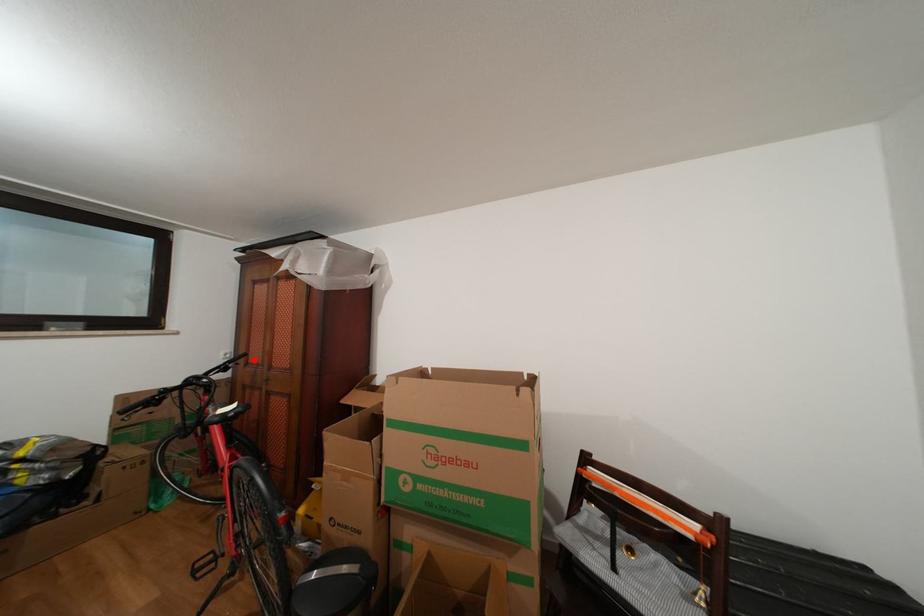
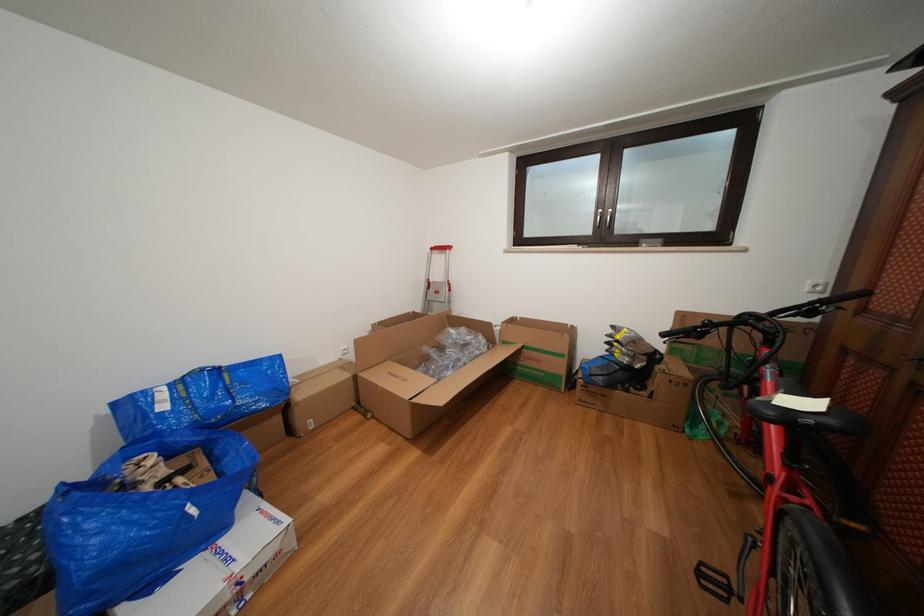
The point at the highlighted location is marked in the first image. Where is the corresponding point in the second image?

(873, 300)